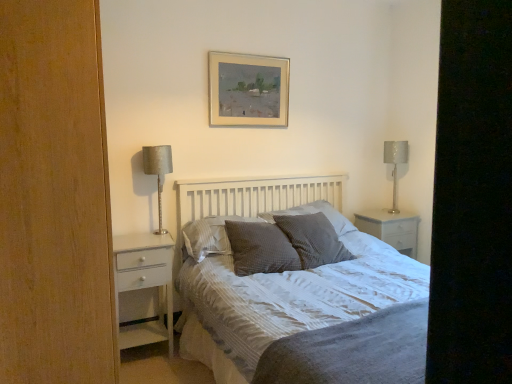
Question: Could you tell me if gray textured pillow at center, the first pillow viewed from the left, is turned towards gray textured pillow at center, acting as the 2th pillow starting from the left?

Choices:
 (A) no
 (B) yes

Answer: (B)

Question: Can you confirm if gray textured pillow at center, the fourth pillow from the right, is positioned to the left of gray textured pillow at center, the 3th pillow viewed from the right?

Choices:
 (A) yes
 (B) no

Answer: (A)

Question: From a real-world perspective, is gray textured pillow at center, the fourth pillow from the right, physically below gray textured pillow at center, the 3th pillow viewed from the right?

Choices:
 (A) yes
 (B) no

Answer: (B)

Question: Is gray textured pillow at center, the fourth pillow from the right, turned away from gray textured pillow at center, the 3th pillow viewed from the right?

Choices:
 (A) yes
 (B) no

Answer: (B)

Question: Can you confirm if gray textured pillow at center, the first pillow viewed from the left, is shorter than gray textured pillow at center, the 3th pillow viewed from the right?

Choices:
 (A) no
 (B) yes

Answer: (B)

Question: From a real-world perspective, is black matte screen door at right physically located above or below silver metallic picture frame at upper center?

Choices:
 (A) below
 (B) above

Answer: (A)

Question: From the image's perspective, is black matte screen door at right positioned above or below silver metallic picture frame at upper center?

Choices:
 (A) below
 (B) above

Answer: (A)

Question: In terms of height, does black matte screen door at right look taller or shorter compared to silver metallic picture frame at upper center?

Choices:
 (A) short
 (B) tall

Answer: (B)

Question: Based on their positions, is black matte screen door at right located to the left or right of silver metallic picture frame at upper center?

Choices:
 (A) right
 (B) left

Answer: (A)

Question: In terms of width, does gray textured pillow at center, acting as the 2th pillow starting from the left, look wider or thinner when compared to white glossy nightstand at right?

Choices:
 (A) wide
 (B) thin

Answer: (B)

Question: In the image, is gray textured pillow at center, the 3th pillow viewed from the right, positioned in front of or behind white glossy nightstand at right?

Choices:
 (A) behind
 (B) front

Answer: (B)

Question: From their relative heights in the image, would you say gray textured pillow at center, acting as the 2th pillow starting from the left, is taller or shorter than white glossy nightstand at right?

Choices:
 (A) tall
 (B) short

Answer: (B)

Question: Visually, is gray textured pillow at center, acting as the 2th pillow starting from the left, positioned to the left or to the right of white glossy nightstand at right?

Choices:
 (A) right
 (B) left

Answer: (B)

Question: Is gray textured pillow at center, acting as the 2th pillow starting from the left, in front of or behind black matte screen door at right in the image?

Choices:
 (A) behind
 (B) front

Answer: (B)

Question: From the image's perspective, is gray textured pillow at center, acting as the 2th pillow starting from the left, above or below black matte screen door at right?

Choices:
 (A) above
 (B) below

Answer: (B)